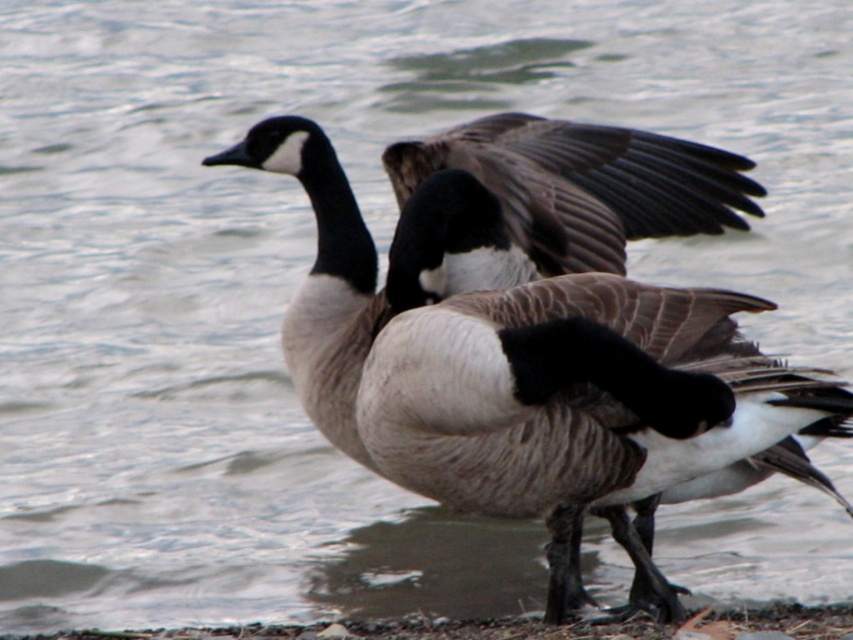
You are a birdwatcher observing two Canada geese near a body of water. You notice a point labeled as point (x=525, y=380) in your field notes. What animal is located at that point?

The point (x=525, y=380) corresponds to a brown feathered duck at center.

You are a birdwatcher observing the scene. You notice the brown feathered duck at center and the dark gray feathered wing at center. Which object is larger?

The brown feathered duck at center is bigger than the dark gray feathered wing at center.

You are a wildlife photographer aiming to capture a closeup shot of the brown feathered duck at center and the dark gray feathered wing at center. Which object do you need to focus on first if you want to ensure both are in focus without adjusting your camera settings?

The brown feathered duck at center is wider than the dark gray feathered wing at center. Since the duck is wider, you should focus on it first to ensure depth of field covers both objects.